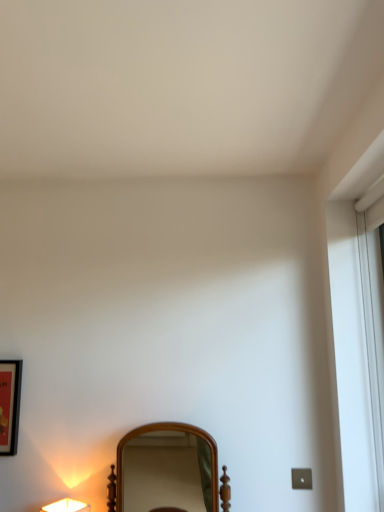
This screenshot has height=512, width=384. In order to click on matte black picture frame at left in this screenshot , I will do `click(10, 405)`.

Is point (7, 454) farther from camera compared to point (75, 500)?

Yes, point (7, 454) is farther from viewer.

Is matte black picture frame at left placed right next to matte white lamp at lower left?

No, matte black picture frame at left is not in contact with matte white lamp at lower left.

How different are the orientations of matte black picture frame at left and matte white lamp at lower left in degrees?

There is a 59.8-degree angle between the facing directions of matte black picture frame at left and matte white lamp at lower left.

Does matte black picture frame at left have a larger size compared to matte white lamp at lower left?

Actually, matte black picture frame at left might be smaller than matte white lamp at lower left.

Considering the relative sizes of matte white lamp at lower left and wooden mirror at center in the image provided, is matte white lamp at lower left smaller than wooden mirror at center?

Indeed, matte white lamp at lower left has a smaller size compared to wooden mirror at center.

From the picture: Considering the relative sizes of matte white lamp at lower left and wooden mirror at center in the image provided, is matte white lamp at lower left thinner than wooden mirror at center?

Indeed, matte white lamp at lower left has a lesser width compared to wooden mirror at center.

Is point (50, 509) positioned in front of point (129, 495)?

Yes.

Who is more distant, matte white lamp at lower left or wooden mirror at center?

matte white lamp at lower left is further from the camera.

Can you confirm if wooden mirror at center is taller than matte white lamp at lower left?

Yes, wooden mirror at center is taller than matte white lamp at lower left.

In the scene shown: Between wooden mirror at center and matte white lamp at lower left, which one has larger width?

wooden mirror at center is wider.

Can we say wooden mirror at center lies outside matte white lamp at lower left?

Yes, wooden mirror at center is outside of matte white lamp at lower left.

Can you confirm if wooden mirror at center is bigger than matte white lamp at lower left?

Yes, wooden mirror at center is bigger than matte white lamp at lower left.

Is wooden mirror at center thinner than matte black picture frame at left?

Incorrect, the width of wooden mirror at center is not less than that of matte black picture frame at left.

Is wooden mirror at center with matte black picture frame at left?

No, wooden mirror at center is not making contact with matte black picture frame at left.

Is wooden mirror at center surrounding matte black picture frame at left?

No, matte black picture frame at left is not a part of wooden mirror at center.

From the picture: How different are the orientations of wooden mirror at center and matte black picture frame at left in degrees?

wooden mirror at center and matte black picture frame at left are facing 0.139 degrees away from each other.

How many degrees apart are the facing directions of matte black picture frame at left and wooden mirror at center?

0.139 degrees.

Consider the image. Between matte black picture frame at left and wooden mirror at center, which one has less height?

With less height is wooden mirror at center.

From a real-world perspective, is matte black picture frame at left physically located above or below wooden mirror at center?

Clearly, from a real-world perspective, matte black picture frame at left is above wooden mirror at center.

From the image's perspective, would you say matte black picture frame at left is positioned over wooden mirror at center?

Yes.

Can you confirm if matte white lamp at lower left is taller than matte black picture frame at left?

No, matte white lamp at lower left is not taller than matte black picture frame at left.

Does matte white lamp at lower left come behind matte black picture frame at left?

No, matte white lamp at lower left is closer to the camera.

Is matte white lamp at lower left situated inside matte black picture frame at left or outside?

matte white lamp at lower left is outside matte black picture frame at left.

Find the location of a particular element. Image resolution: width=384 pixels, height=512 pixels. picture frame lying behind the matte white lamp at lower left is located at coordinates (10, 405).

Where is `picture frame above the matte white lamp at lower left (from the image's perspective)`? This screenshot has width=384, height=512. picture frame above the matte white lamp at lower left (from the image's perspective) is located at coordinates (10, 405).

The width and height of the screenshot is (384, 512). In order to click on mirror on the right of matte white lamp at lower left in this screenshot , I will do `click(167, 472)`.

Estimate the real-world distances between objects in this image. Which object is further from matte black picture frame at left, matte white lamp at lower left or wooden mirror at center?

wooden mirror at center is further to matte black picture frame at left.

Estimate the real-world distances between objects in this image. Which object is further from wooden mirror at center, matte black picture frame at left or matte white lamp at lower left?

The object further to wooden mirror at center is matte white lamp at lower left.

Looking at the image, which one is located further to wooden mirror at center, matte white lamp at lower left or matte black picture frame at left?

The object further to wooden mirror at center is matte white lamp at lower left.

Based on their spatial positions, is wooden mirror at center or matte white lamp at lower left closer to matte black picture frame at left?

matte white lamp at lower left is closer to matte black picture frame at left.

Looking at the image, which one is located further to matte white lamp at lower left, matte black picture frame at left or wooden mirror at center?

wooden mirror at center is further to matte white lamp at lower left.

When comparing their distances from matte white lamp at lower left, does wooden mirror at center or matte black picture frame at left seem closer?

matte black picture frame at left lies closer to matte white lamp at lower left than the other object.

The image size is (384, 512). I want to click on lamp situated between matte black picture frame at left and wooden mirror at center from left to right, so click(x=67, y=506).